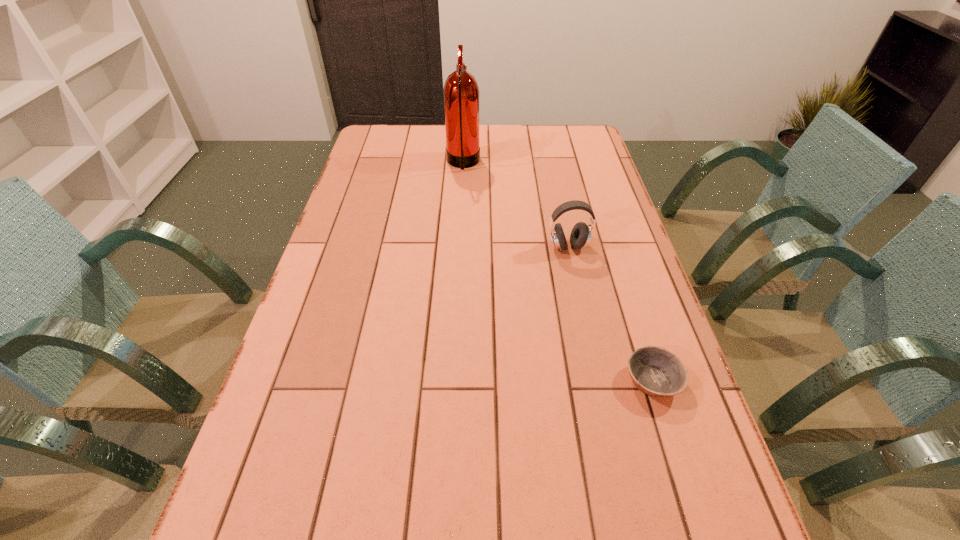
Where is `free space between the second farthest object and the farthest object`? The height and width of the screenshot is (540, 960). free space between the second farthest object and the farthest object is located at coordinates (516, 205).

Identify the location of object that stands as the closest to the bowl. (580, 236).

Where is `object that can be found as the second closest to the shortest object`? object that can be found as the second closest to the shortest object is located at coordinates (461, 92).

You are a GUI agent. You are given a task and a screenshot of the screen. Output one action in this format:
    pyautogui.click(x=<x>, y=<y>)
    Task: Click on the vacant area in the image that satisfies the following two spatial constraints: 1. on the front-facing side of the nearest object; 2. on the left side of the tallest object
    
    Given the screenshot: What is the action you would take?
    pyautogui.click(x=452, y=380)

You are a GUI agent. You are given a task and a screenshot of the screen. Output one action in this format:
    pyautogui.click(x=<x>, y=<y>)
    Task: Click on the free space that satisfies the following two spatial constraints: 1. on the back side of the nearest object; 2. on the front-facing side of the fire extinguisher
    The width and height of the screenshot is (960, 540).
    Given the screenshot: What is the action you would take?
    pyautogui.click(x=584, y=163)

Locate an element on the screen. free space that satisfies the following two spatial constraints: 1. on the front-facing side of the farthest object; 2. on the right side of the shortest object is located at coordinates (452, 380).

What are the coordinates of `vacant point that satisfies the following two spatial constraints: 1. on the front-facing side of the tallest object; 2. on the right side of the bowl` in the screenshot? It's located at (452, 380).